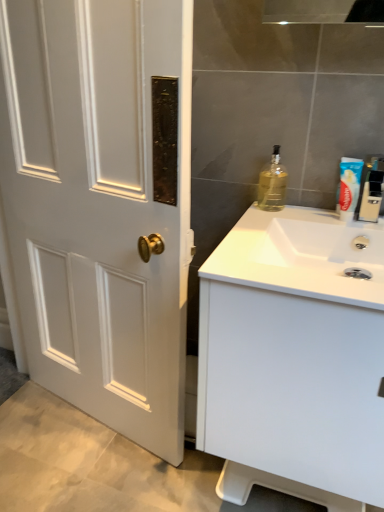
At what (x,y) coordinates should I click in order to perform the action: click on vacant space in front of translucent glass bottle at upper right, which ranks as the 1th bottle in left-to-right order. Please return your answer as a coordinate pair (x, y). Looking at the image, I should click on (265, 219).